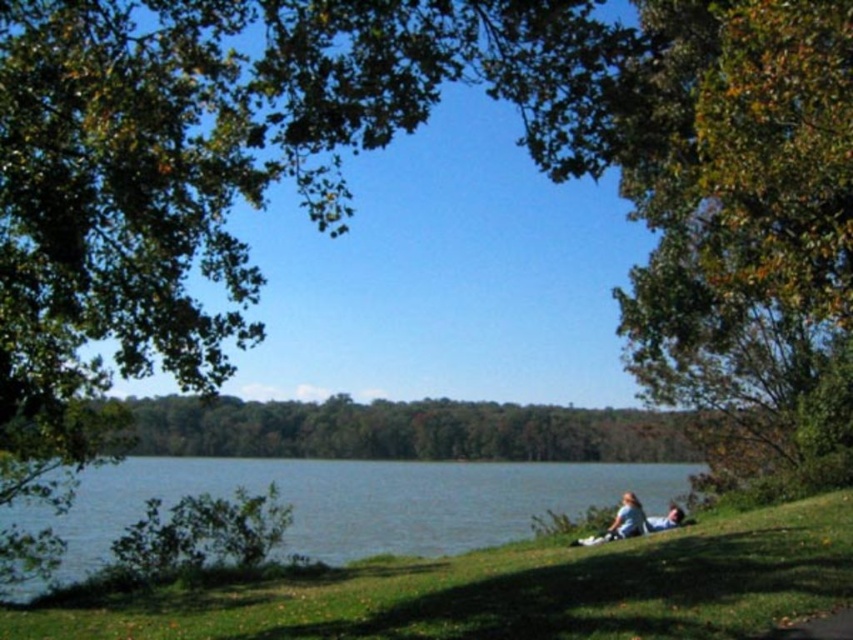
You are standing at the point labeled as point [350,500] in the image. What is the nearest object to you in the scene?

The nearest object to you at point [350,500] is the blue water at lower left.

You are a photographer planning to take a photo of the blue water at lower left and the light blue fabric couple at lower right. Which object should you focus on first if you want both to be in sharp focus?

The blue water at lower left is in front of the light blue fabric couple at lower right. To have both in sharp focus, you should focus on the light blue fabric couple at lower right first since it is farther away, ensuring the depth of field includes both.